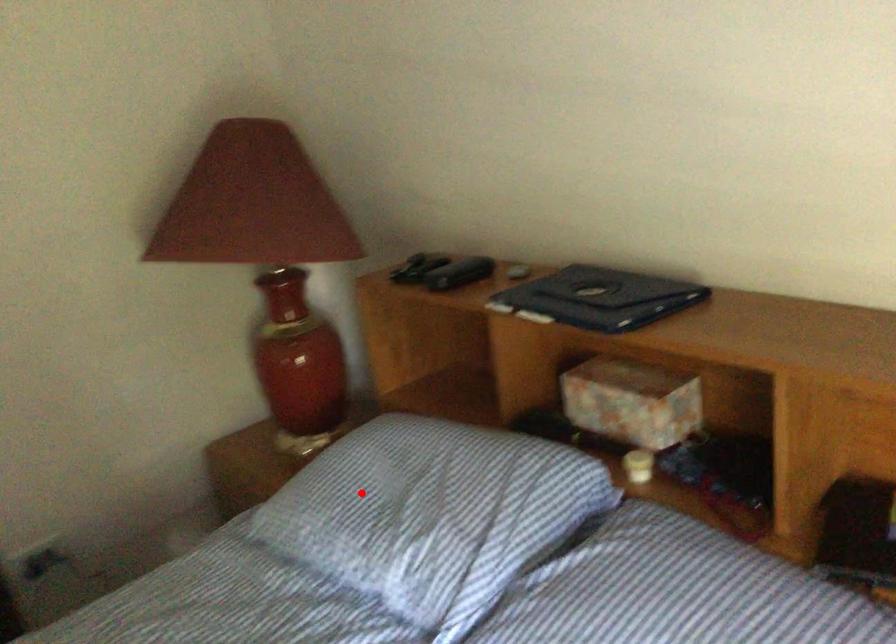
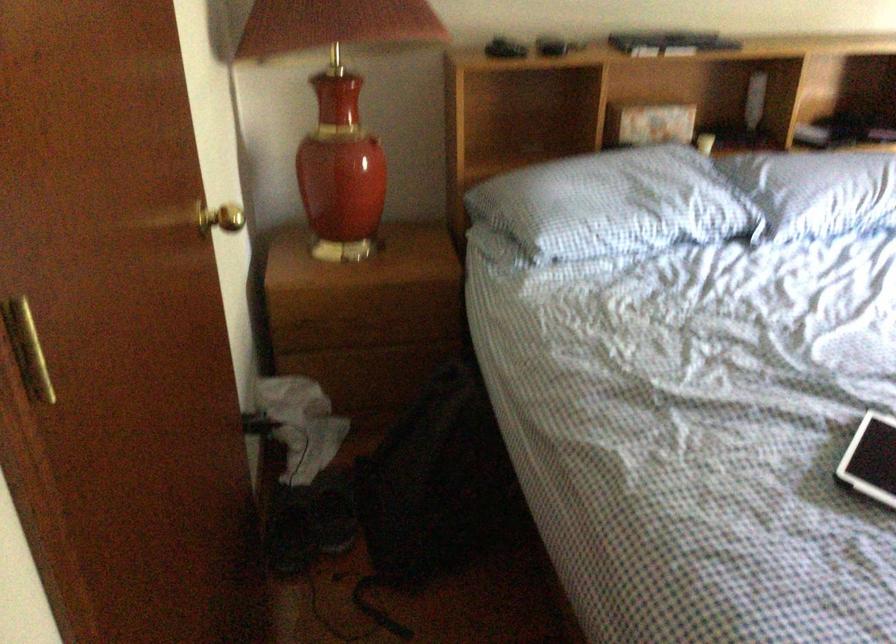
Question: A red point is marked in image1. In image2, is the corresponding 3D point closer to the camera or farther? Reply with the corresponding letter.

Choices:
 (A) The corresponding 3D point is closer.
 (B) The corresponding 3D point is farther.

Answer: (B)